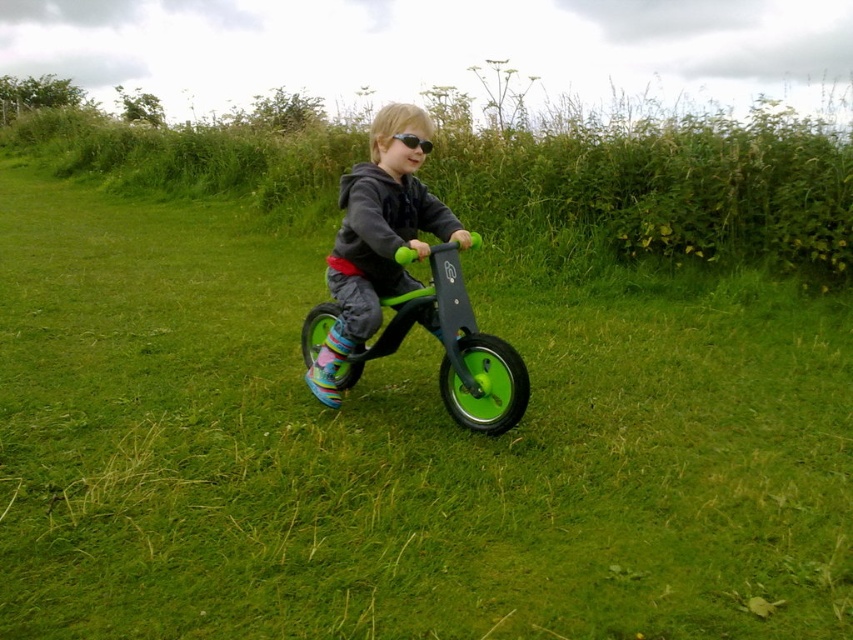
You are a delivery robot with a width of 0.5 meters. You need to pass through the space between the green rubber bicycle at center and the black matte goggles at center. Can you fit through?

The green rubber bicycle at center is wider than the black matte goggles at center. To determine if you can pass through, measure the narrowest point between them. If it is at least 0.5 meters wide, you can fit through.

You are a drone operator trying to capture a photo of the matte green bicycle at center. The drone is currently at coordinates point A, which is at the top left corner of the image. To get the best shot, you need to move the drone directly above the bicycle. What direction should you move the drone from point A to reach the bicycle?

The matte green bicycle at center is located at point coordinates (376, 237). Since the drone is at the top left corner, moving it diagonally downward to the right will position it directly above the bicycle.

You are a parent trying to choose a bicycle for your child. You see two bicycles in the image, a matte green bicycle at center and a green rubber bicycle at center. Which one is taller?

The matte green bicycle at center is taller than the green rubber bicycle at center.